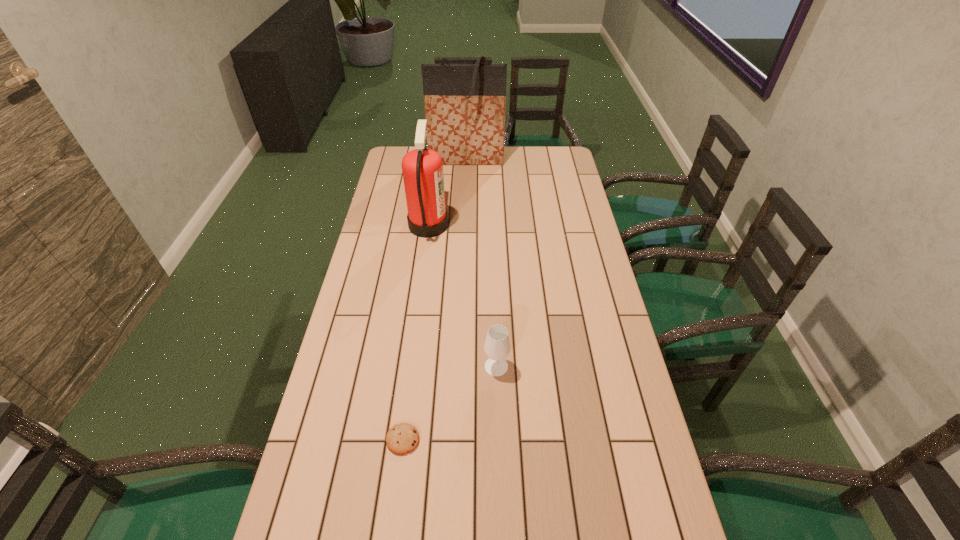
What are the coordinates of `vacant region located on the back of the glass` in the screenshot? It's located at (493, 271).

Where is `vacant space situated 0.160m on the left of the shortest object`? The height and width of the screenshot is (540, 960). vacant space situated 0.160m on the left of the shortest object is located at coordinates (324, 440).

Where is `object positioned at the far edge`? The height and width of the screenshot is (540, 960). object positioned at the far edge is located at coordinates (465, 104).

The width and height of the screenshot is (960, 540). Identify the location of object that is at the left edge. (422, 168).

At what (x,y) coordinates should I click in order to perform the action: click on vacant space at the left edge. Please return your answer as a coordinate pair (x, y). This screenshot has height=540, width=960. Looking at the image, I should click on (371, 456).

In the image, there is a desktop. What are the coordinates of `vacant space at the right edge` in the screenshot? It's located at (626, 404).

In order to click on vacant space at the far left corner of the desktop in this screenshot , I will do `click(393, 157)`.

Locate an element on the screen. The width and height of the screenshot is (960, 540). vacant region at the far right corner of the desktop is located at coordinates (542, 148).

I want to click on empty space between the cookie and the glass, so click(449, 403).

This screenshot has width=960, height=540. In order to click on free space between the tallest object and the nearest object in this screenshot , I will do `click(435, 299)`.